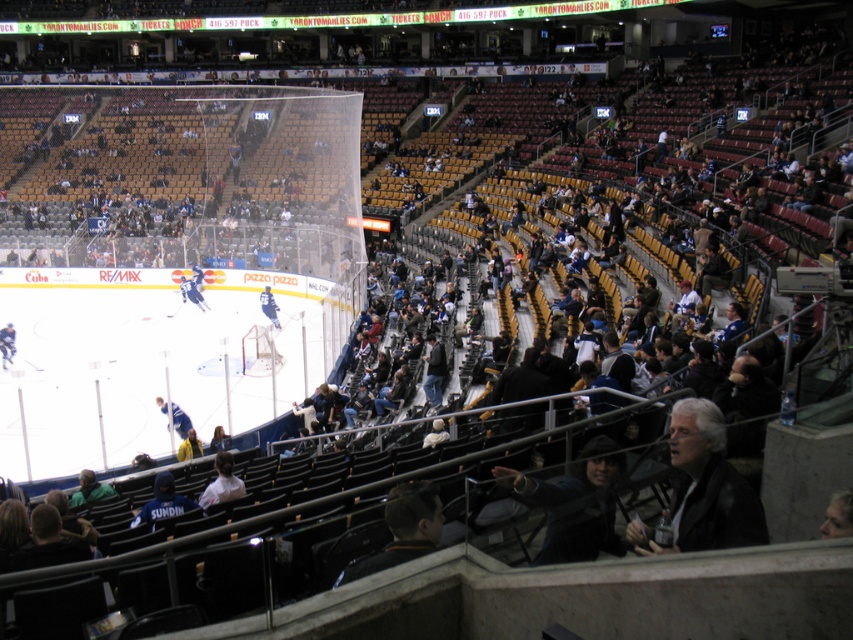
Based on the photo, you are a spectator sitting in the arena and want to hand a dark blue knit cap at lower left to a friend who is standing 50 feet away from you. Can you reach them directly without getting up?

The dark blue knit cap at lower left and viewer are 55.70 feet apart, so you cannot reach them directly as the distance is greater than 50 feet.

You are a photographer standing in the arena and want to capture both the gray hair at center and the black leather jacket at lower center in a single shot without moving your camera. Can you fit both objects in your current field of view?

The gray hair at center might be wider than black leather jacket at lower center, so it depends on the camera angle and zoom level. If the camera is positioned such that the field of view can encompass the width of the gray hair at center, then both objects can be captured. Adjusting the zoom or angle may be necessary to ensure both are visible.